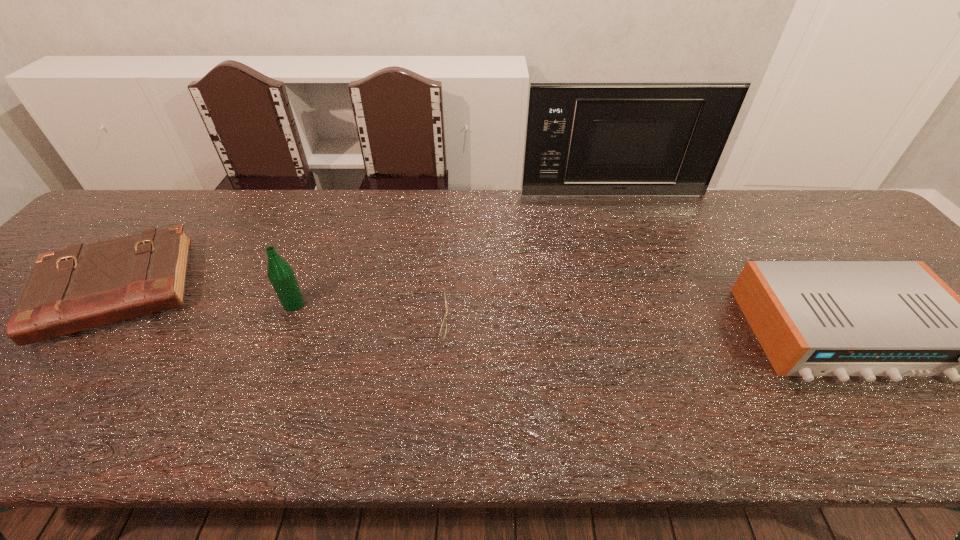
Identify the location of vacant area at the far edge of the desktop. (407, 238).

The height and width of the screenshot is (540, 960). Find the location of `blank space at the near edge of the desktop`. blank space at the near edge of the desktop is located at coordinates (734, 440).

You are a GUI agent. You are given a task and a screenshot of the screen. Output one action in this format:
    pyautogui.click(x=<x>, y=<y>)
    Task: Click on the vacant space at the far left corner of the desktop
    This screenshot has width=960, height=540.
    Given the screenshot: What is the action you would take?
    pyautogui.click(x=129, y=226)

Find the location of a particular element. vacant area that lies between the second object from left to right and the farthest object is located at coordinates (453, 250).

Image resolution: width=960 pixels, height=540 pixels. In order to click on unoccupied area between the shortest object and the bottle in this screenshot , I will do `click(357, 313)`.

At what (x,y) coordinates should I click in order to perform the action: click on vacant area that lies between the tallest object and the bottle. Please return your answer as a coordinate pair (x, y). The height and width of the screenshot is (540, 960). Looking at the image, I should click on (453, 250).

You are a GUI agent. You are given a task and a screenshot of the screen. Output one action in this format:
    pyautogui.click(x=<x>, y=<y>)
    Task: Click on the unoccupied position between the farthest object and the bottle
    
    Given the screenshot: What is the action you would take?
    pyautogui.click(x=453, y=250)

The image size is (960, 540). Identify the location of unoccupied position between the fourth shortest object and the spectacles. (357, 313).

This screenshot has height=540, width=960. Find the location of `object that stands as the second closest to the microwave oven`. object that stands as the second closest to the microwave oven is located at coordinates (443, 329).

Identify which object is the fourth nearest to the leftmost object. Please provide its 2D coordinates. Your answer should be formatted as a tuple, i.e. [(x, y)], where the tuple contains the x and y coordinates of a point satisfying the conditions above.

[(812, 318)]